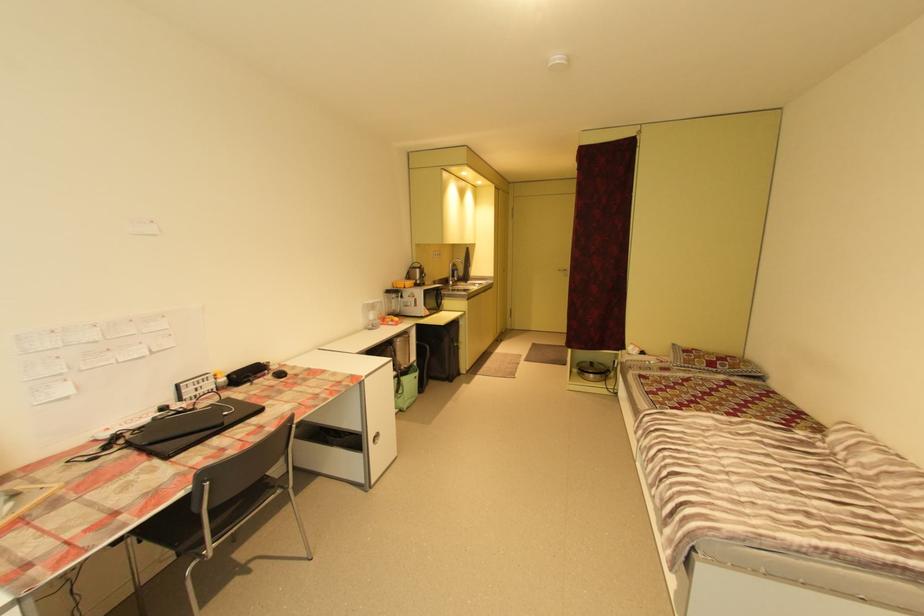
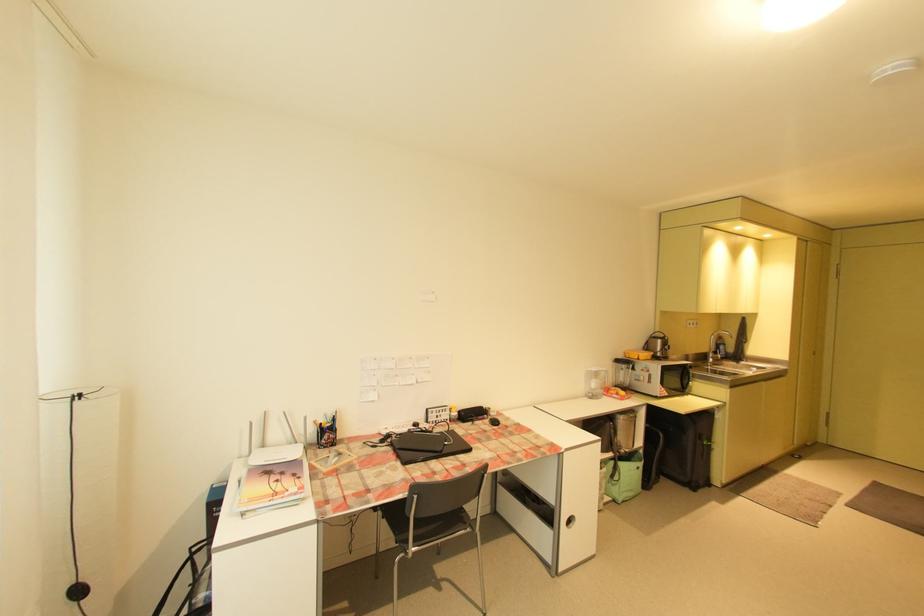
Where in the second image is the point corresponding to (442,301) from the first image?

(686, 381)